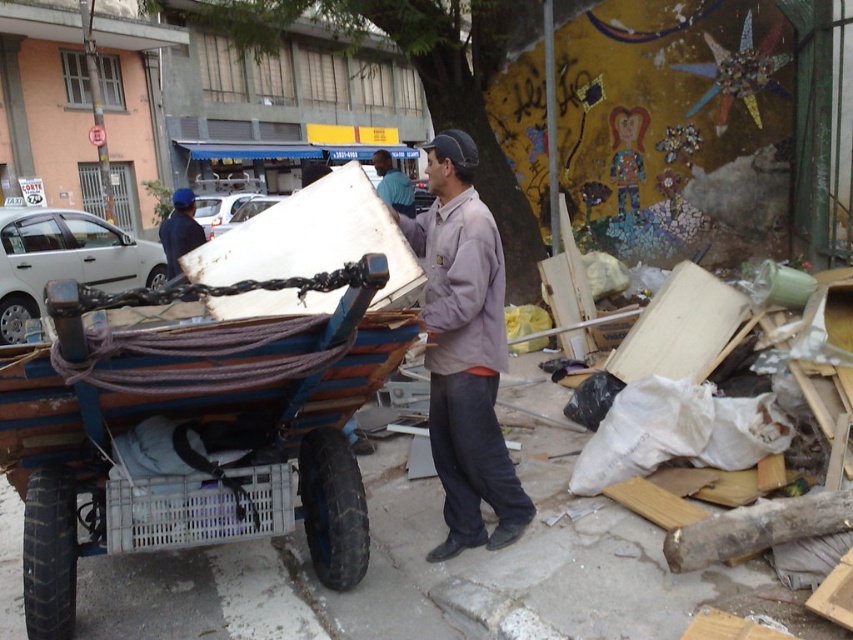
Between point (526, 499) and point (398, 188), which one is positioned behind?

Point (398, 188)

Between gray cotton shirt at center and blue shirt at center, which one appears on the left side from the viewer's perspective?

blue shirt at center is more to the left.

At what (x,y) coordinates should I click in order to perform the action: click on gray cotton shirt at center. Please return your answer as a coordinate pair (x, y). The image size is (853, 640). Looking at the image, I should click on (463, 349).

Where is `gray cotton shirt at center`? Image resolution: width=853 pixels, height=640 pixels. gray cotton shirt at center is located at coordinates (463, 349).

In the scene shown: Does blue wooden wagon at lower left appear on the right side of blue shirt at center?

Correct, you'll find blue wooden wagon at lower left to the right of blue shirt at center.

Does blue wooden wagon at lower left have a greater height compared to blue shirt at center?

No, blue wooden wagon at lower left is not taller than blue shirt at center.

Is point (335, 280) positioned in front of point (381, 154)?

Yes, point (335, 280) is in front of point (381, 154).

Find the location of a particular element. The width and height of the screenshot is (853, 640). blue wooden wagon at lower left is located at coordinates (192, 429).

Can you confirm if white plastic crate at lower left is bigger than blue shirt at center?

Actually, white plastic crate at lower left might be smaller than blue shirt at center.

Can you confirm if white plastic crate at lower left is positioned to the left of blue shirt at center?

No, white plastic crate at lower left is not to the left of blue shirt at center.

Locate an element on the screen. white plastic crate at lower left is located at coordinates (198, 508).